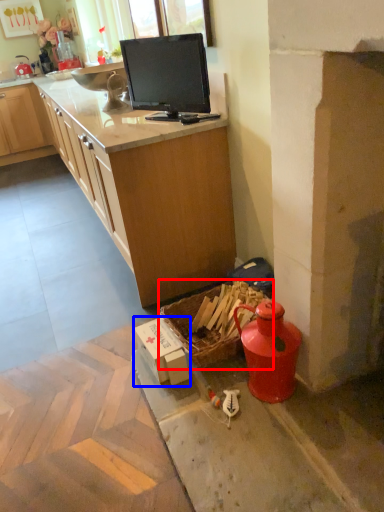
Question: Which object appears farthest to the camera in this image, picnic basket (highlighted by a red box) or cardboard box (highlighted by a blue box)?

Choices:
 (A) picnic basket
 (B) cardboard box

Answer: (B)